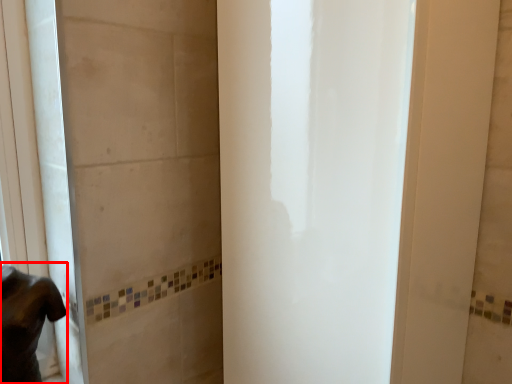
Question: From the image, what is the correct spatial relationship of person (annotated by the red box) in relation to screen door?

Choices:
 (A) left
 (B) right

Answer: (A)